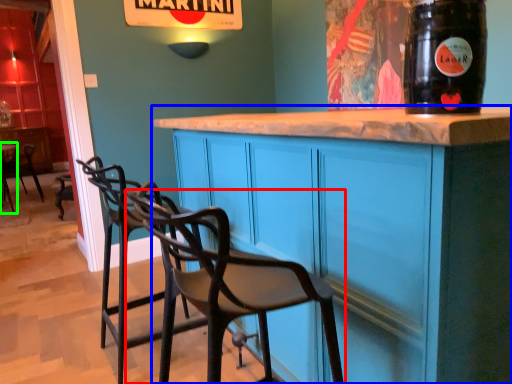
Question: Considering the real-world distances, which object is farthest from chair (highlighted by a red box)? cabinetry (highlighted by a blue box) or table (highlighted by a green box)?

Choices:
 (A) cabinetry
 (B) table

Answer: (B)